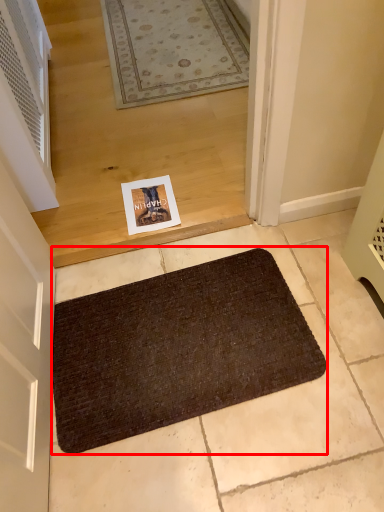
Question: From the image's perspective, where is bath mat (annotated by the red box) located in relation to air conditioner in the image?

Choices:
 (A) above
 (B) below

Answer: (B)